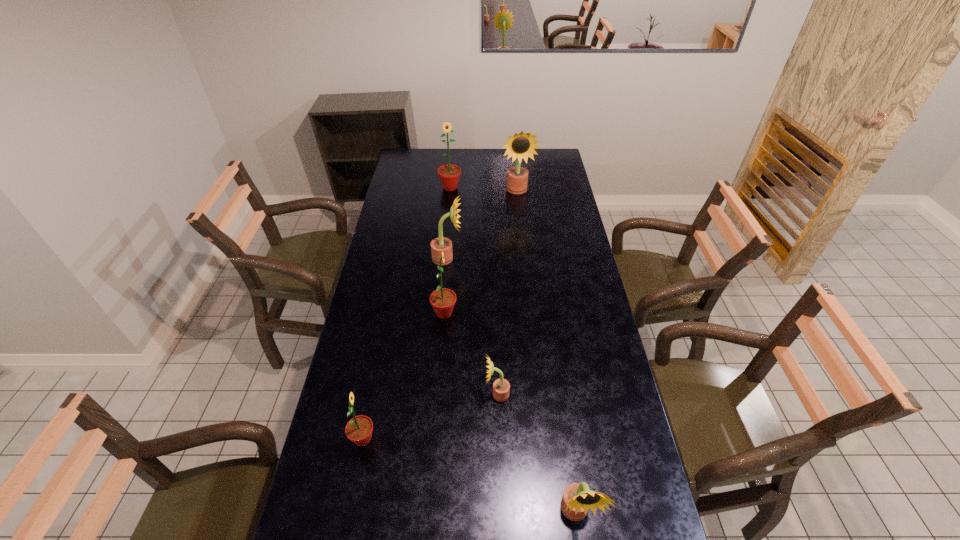
Where is `free space between the nearest green sunflower and the second smallest yellow sunflower`? free space between the nearest green sunflower and the second smallest yellow sunflower is located at coordinates (469, 476).

The image size is (960, 540). Find the location of `object that is the closest to the fourth nearest object`. object that is the closest to the fourth nearest object is located at coordinates (439, 244).

Image resolution: width=960 pixels, height=540 pixels. I want to click on object identified as the second closest to the fifth sunflower from left to right, so click(x=577, y=498).

Locate which sunflower is the fifth closest to the nearest green sunflower. Please provide its 2D coordinates. Your answer should be formatted as a tuple, i.e. [(x, y)], where the tuple contains the x and y coordinates of a point satisfying the conditions above.

[(449, 174)]

The width and height of the screenshot is (960, 540). What are the coordinates of `sunflower identified as the second closest to the second smallest green sunflower` in the screenshot? It's located at [501, 387].

I want to click on yellow sunflower that stands as the second closest to the third smallest yellow sunflower, so (501, 387).

Locate which yellow sunflower ranks in proximity to the farthest yellow sunflower. Please provide its 2D coordinates. Your answer should be formatted as a tuple, i.e. [(x, y)], where the tuple contains the x and y coordinates of a point satisfying the conditions above.

[(439, 244)]

Select which green sunflower appears as the closest to the farthest green sunflower. Please provide its 2D coordinates. Your answer should be formatted as a tuple, i.e. [(x, y)], where the tuple contains the x and y coordinates of a point satisfying the conditions above.

[(442, 300)]

In order to click on green sunflower that is the closest to the biggest green sunflower in this screenshot , I will do `click(442, 300)`.

The image size is (960, 540). In order to click on vacant position in the image that satisfies the following two spatial constraints: 1. on the face of the farthest yellow sunflower; 2. on the face of the smallest green sunflower in this screenshot , I will do `click(544, 439)`.